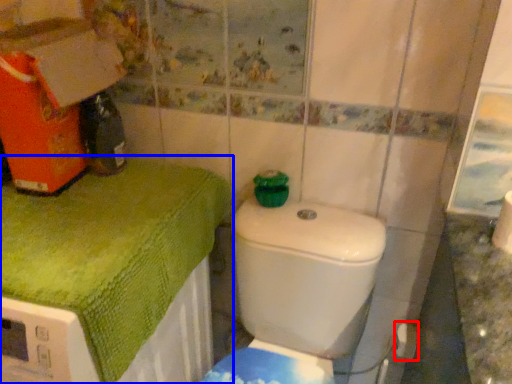
Question: Among these objects, which one is farthest to the camera, toilet paper (highlighted by a red box) or bath towel (highlighted by a blue box)?

Choices:
 (A) toilet paper
 (B) bath towel

Answer: (A)